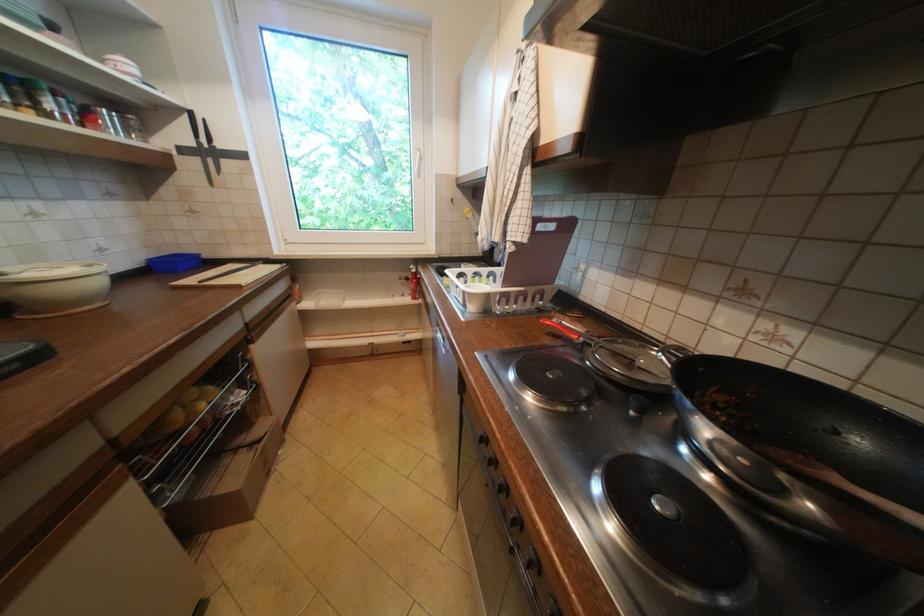
At what (x,y) coordinates should I click in order to perform the action: click on pot lid handle. Please return your answer as a coordinate pair (x, y). Looking at the image, I should click on (578, 326).